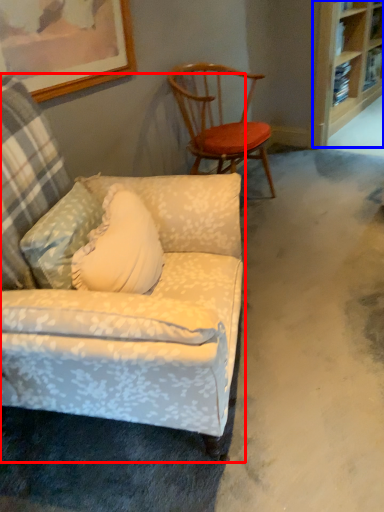
Question: Which point is further to the camera, chair (highlighted by a red box) or shelf (highlighted by a blue box)?

Choices:
 (A) chair
 (B) shelf

Answer: (B)